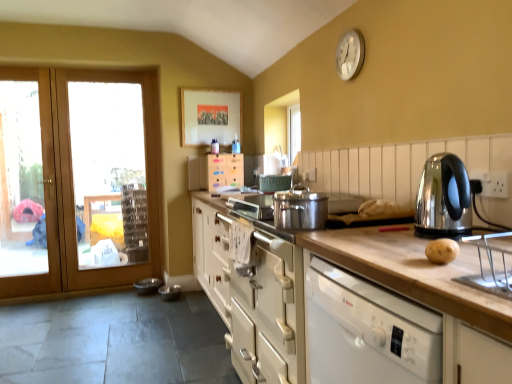
Image resolution: width=512 pixels, height=384 pixels. Identify the location of free spot above white wood cabinet at center, which appears as the 1th cabinetry when viewed from the back (from a real-world perspective). (222, 147).